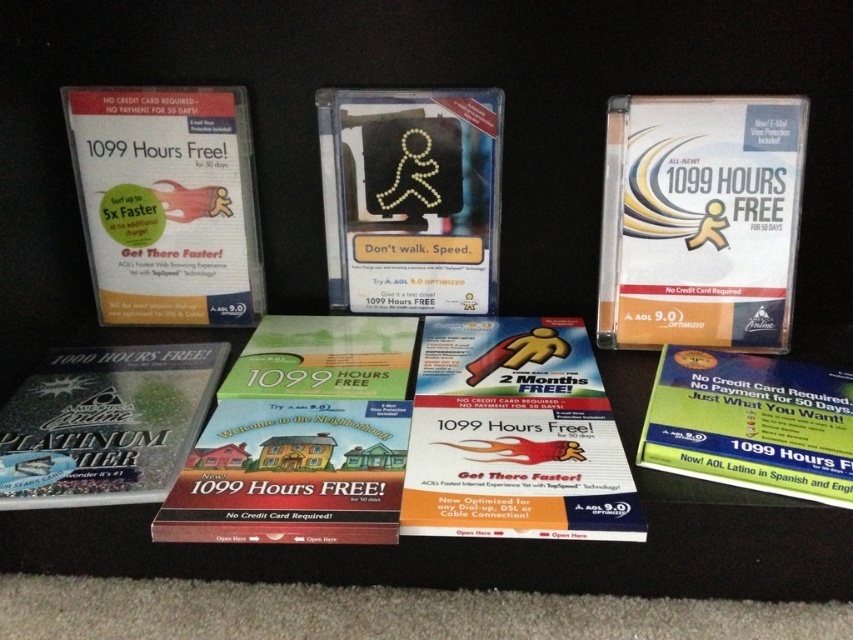
Question: Is green matte book at center wider than green matte book at lower right?

Choices:
 (A) yes
 (B) no

Answer: (B)

Question: Which object is closer to the camera taking this photo?

Choices:
 (A) matte plastic booklet at center
 (B) sparkly silver cd at lower left
 (C) matte plastic sign at center

Answer: (A)

Question: Which point is closer to the camera?

Choices:
 (A) green matte book at lower right
 (B) sparkly silver cd at lower left

Answer: (A)

Question: Is matte plastic cd at upper left smaller than sparkly silver cd at lower left?

Choices:
 (A) yes
 (B) no

Answer: (A)

Question: Is matte plastic booklet at center behind sparkly silver cd at lower left?

Choices:
 (A) yes
 (B) no

Answer: (B)

Question: Among these points, which one is farthest from the camera?

Choices:
 (A) (357, 266)
 (B) (532, 321)
 (C) (26, 428)

Answer: (A)